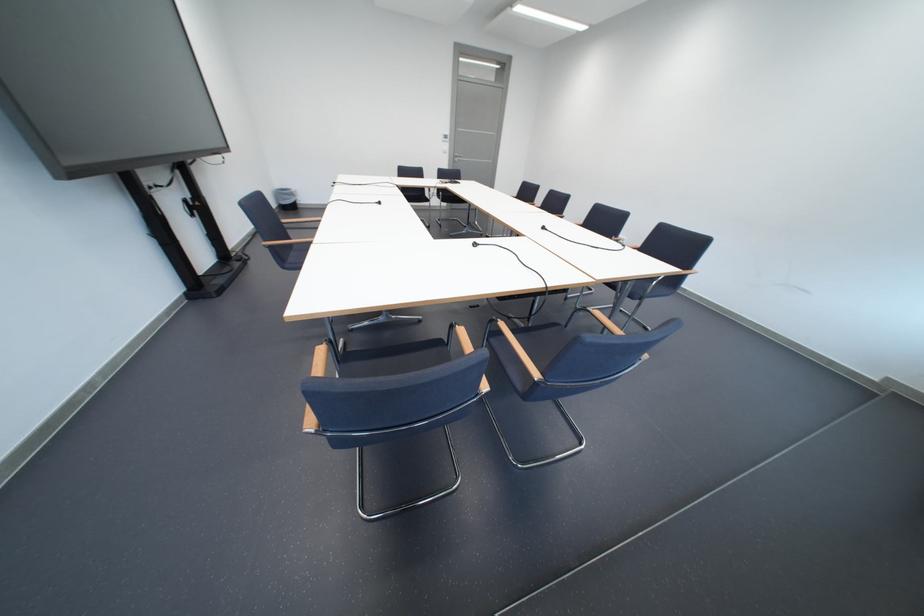
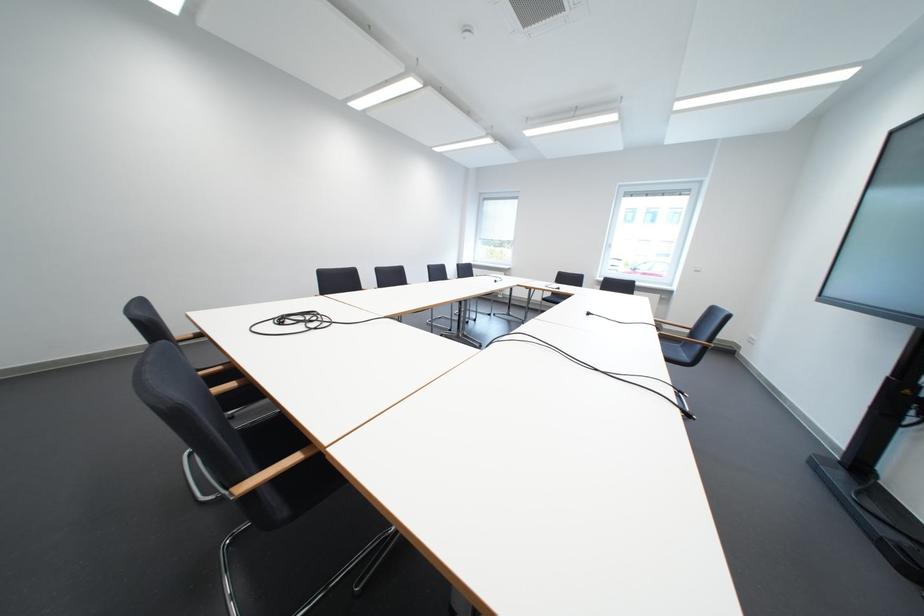
Locate, in the second image, the point that corresponds to (x=392, y=205) in the first image.

(601, 315)